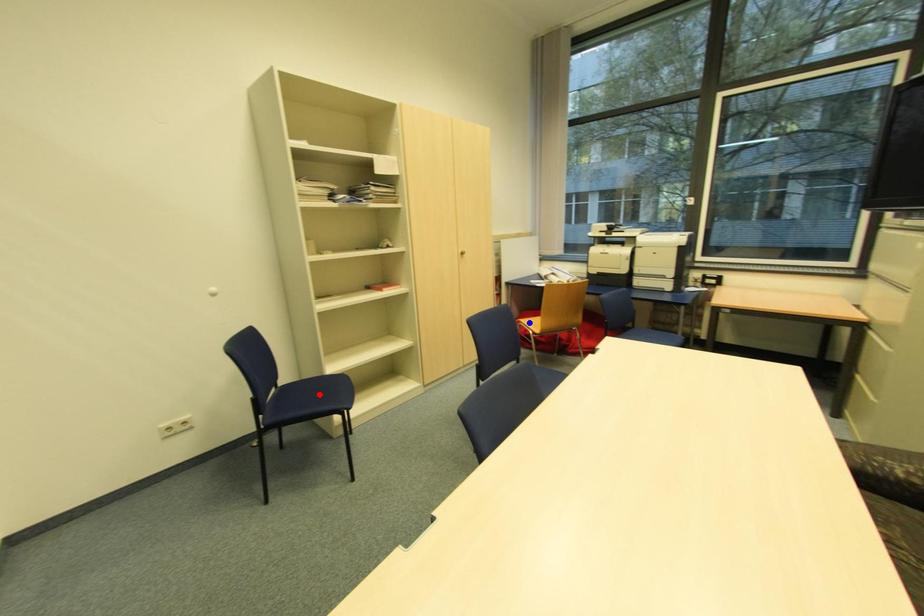
Question: In the image, two points are highlighted. Which point is nearer to the camera? Reply with the corresponding letter.

Choices:
 (A) blue point
 (B) red point

Answer: (B)